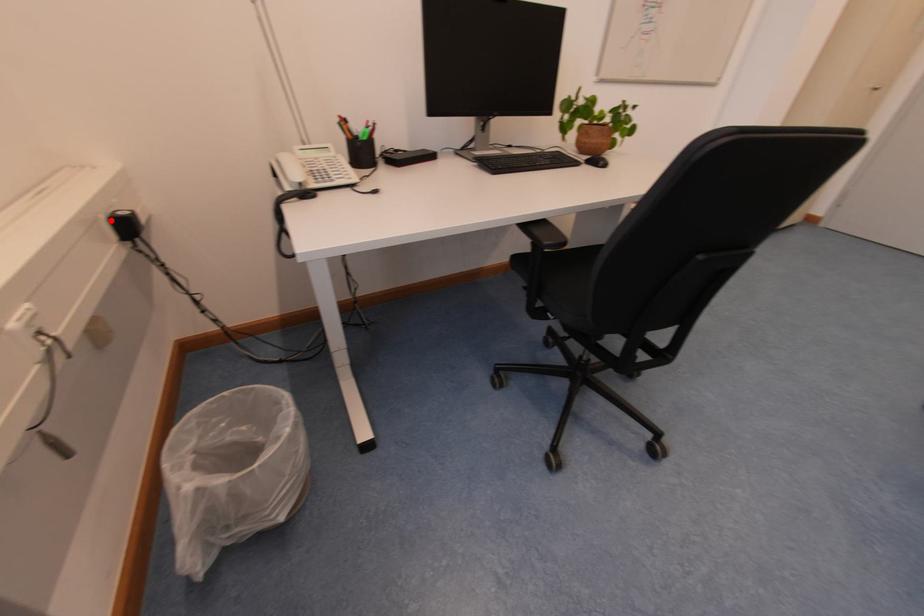
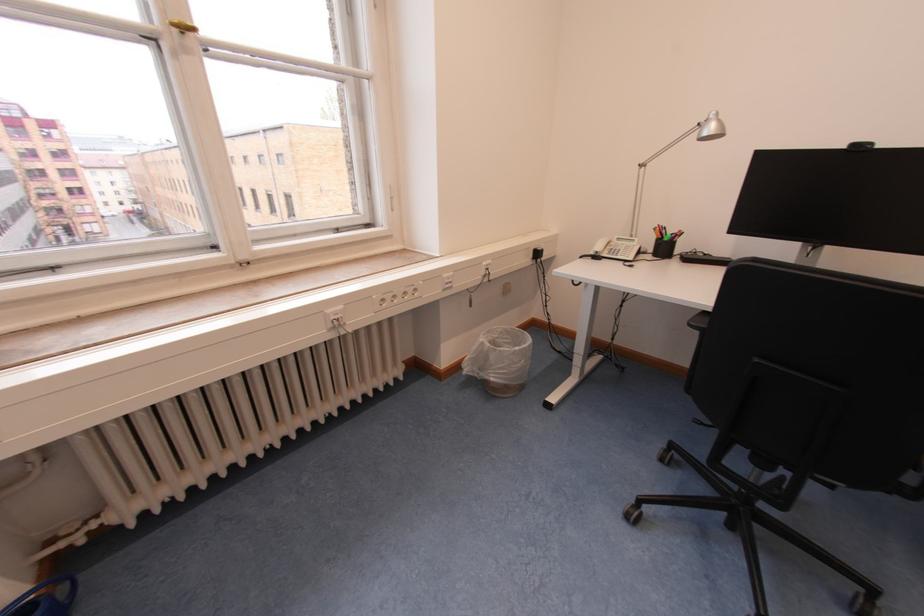
Question: I am providing you with two images of the same scene from different viewpoints. Image1 has a red point marked. In image2, the corresponding 3D location appears at what relative position? Reply with the corresponding letter.

Choices:
 (A) Closer
 (B) Farther

Answer: (A)